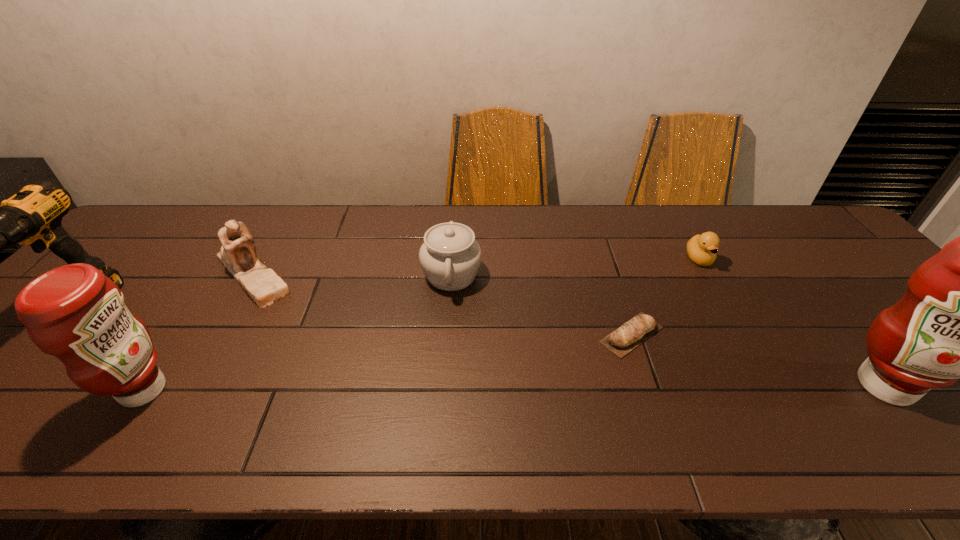
Locate an element on the screen. free space located on the left of the shorter condiment is located at coordinates (80, 390).

Identify the location of vacant space situated 0.130m on the back of the right condiment. (830, 318).

Image resolution: width=960 pixels, height=540 pixels. Find the location of `vacant area situated 0.220m on the face of the duckling`. vacant area situated 0.220m on the face of the duckling is located at coordinates (740, 330).

Find the location of a particular element. This screenshot has width=960, height=540. vacant point located 0.170m on the right of the fourth object from right to left is located at coordinates (542, 275).

Locate an element on the screen. The width and height of the screenshot is (960, 540). free location located 0.230m on the front-facing side of the figurine is located at coordinates (189, 384).

The height and width of the screenshot is (540, 960). Identify the location of free space located at the tip of the drill. (1, 400).

Where is `free space located 0.340m on the left of the shortest object`? free space located 0.340m on the left of the shortest object is located at coordinates (458, 335).

Where is `duckling positioned at the far edge`? duckling positioned at the far edge is located at coordinates (701, 249).

You are a GUI agent. You are given a task and a screenshot of the screen. Output one action in this format:
    pyautogui.click(x=<x>, y=<y>)
    Task: Click on the chinaware that is at the far edge
    This screenshot has width=960, height=540.
    Given the screenshot: What is the action you would take?
    pyautogui.click(x=450, y=257)

The width and height of the screenshot is (960, 540). In order to click on figurine at the far edge in this screenshot , I will do `click(238, 254)`.